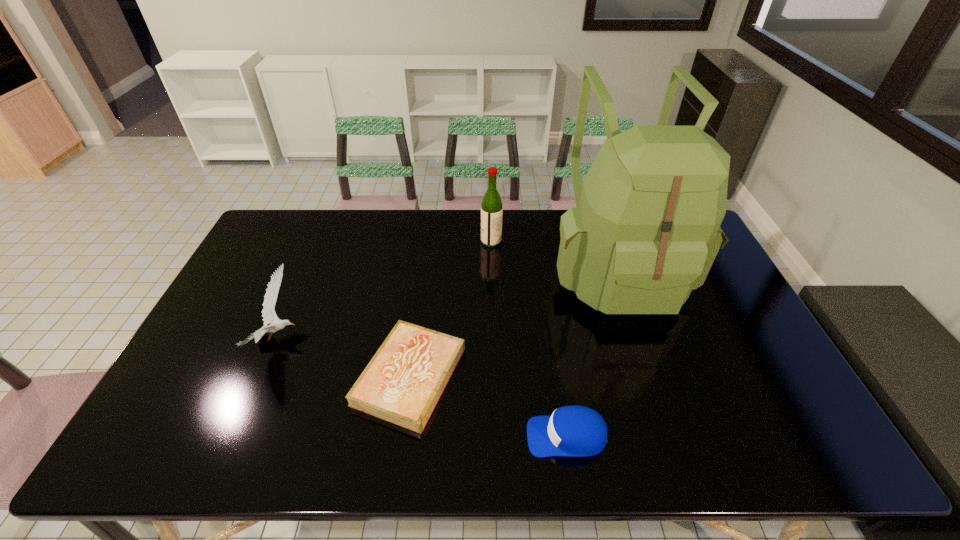
The image size is (960, 540). What are the coordinates of `hardback book that is positioned at the near edge` in the screenshot? It's located at (402, 383).

You are a GUI agent. You are given a task and a screenshot of the screen. Output one action in this format:
    pyautogui.click(x=<x>, y=<y>)
    Task: Click on the object located in the left edge section of the desktop
    Image resolution: width=960 pixels, height=540 pixels.
    Given the screenshot: What is the action you would take?
    pyautogui.click(x=269, y=315)

Where is `object present at the right edge`? Image resolution: width=960 pixels, height=540 pixels. object present at the right edge is located at coordinates (645, 232).

At what (x,y) coordinates should I click in order to perform the action: click on object at the far right corner. Please return your answer as a coordinate pair (x, y). Looking at the image, I should click on point(645,232).

Locate an element on the screen. free space at the far edge is located at coordinates (x=553, y=224).

You are a GUI agent. You are given a task and a screenshot of the screen. Output one action in this format:
    pyautogui.click(x=<x>, y=<y>)
    Task: Click on the vacant region at the near edge of the desktop
    
    Given the screenshot: What is the action you would take?
    pyautogui.click(x=334, y=435)

The height and width of the screenshot is (540, 960). Identify the location of vacant region at the left edge of the desktop. (218, 346).

The height and width of the screenshot is (540, 960). Find the location of `vacant region at the right edge of the desktop`. vacant region at the right edge of the desktop is located at coordinates (775, 395).

The width and height of the screenshot is (960, 540). Find the location of `free region at the near left corner`. free region at the near left corner is located at coordinates (146, 460).

Find the location of a particular element. The height and width of the screenshot is (540, 960). vacant space at the near right corner of the desktop is located at coordinates (804, 430).